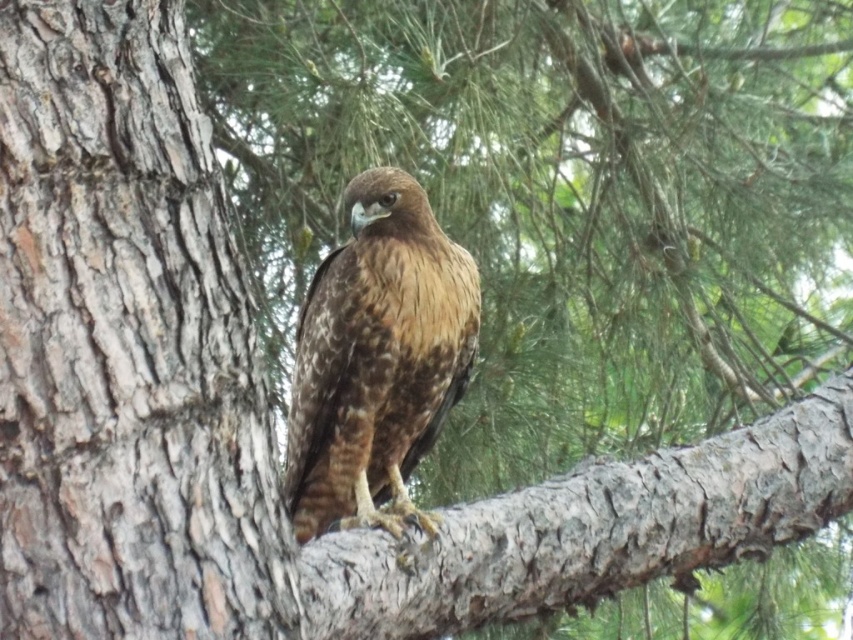
You are an ornithologist observing a hawk perched on a branch. You notice two structures in the scene described as the smooth bark tree trunk at center and the smooth bark branch at center. Which of these two has a wider width?

The smooth bark branch at center has a greater width compared to the smooth bark tree trunk at center, as the tree trunk is narrower in this case.

You are a birdwatcher observing the hawk in the image. You notice the smooth bark branch at center and the brown speckled feathers at center. Which object is closer to you?

The smooth bark branch at center is closer to you because it is in front of the brown speckled feathers at center.